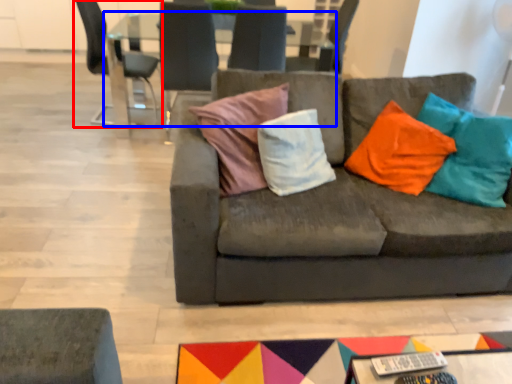
Question: Which of the following is the closest to the observer, chair (highlighted by a red box) or table (highlighted by a blue box)?

Choices:
 (A) chair
 (B) table

Answer: (B)